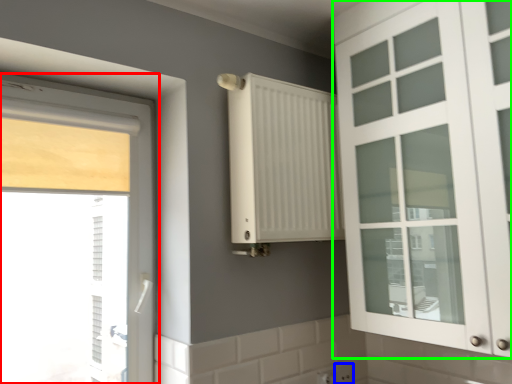
Question: Considering the real-world distances, which object is farthest from window (highlighted by a red box)? electric outlet (highlighted by a blue box) or cabinetry (highlighted by a green box)?

Choices:
 (A) electric outlet
 (B) cabinetry

Answer: (B)